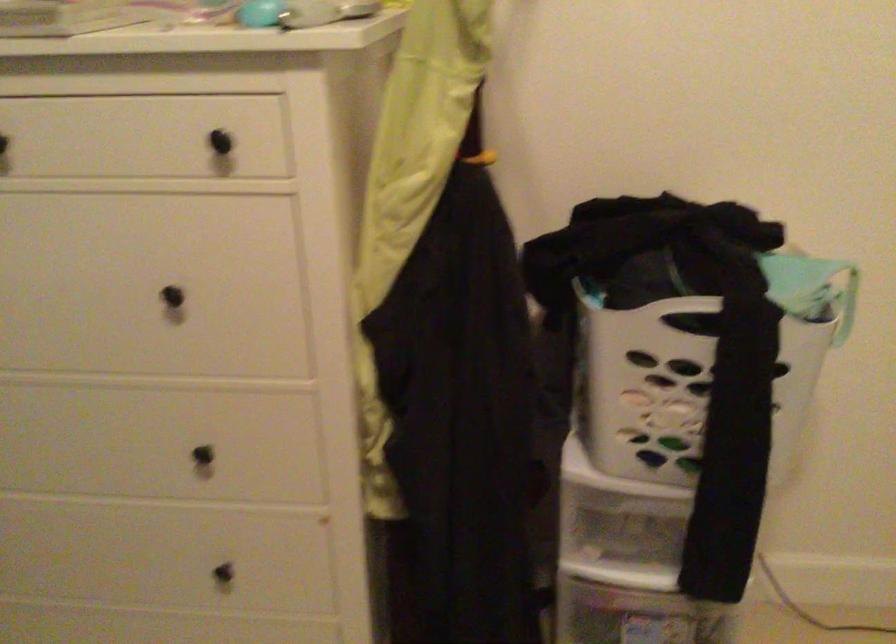
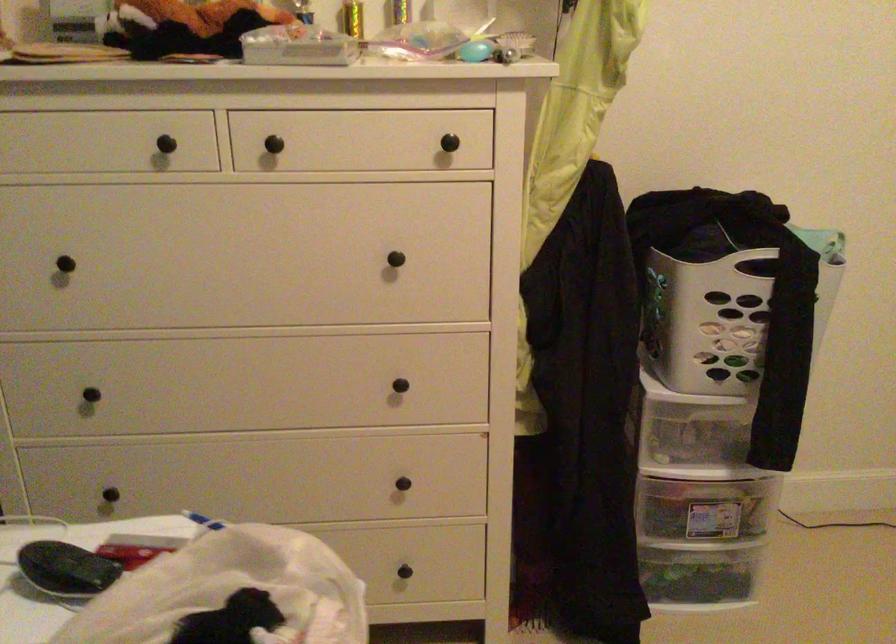
In the second image, find the point that corresponds to point 794,345 in the first image.

(829, 277)